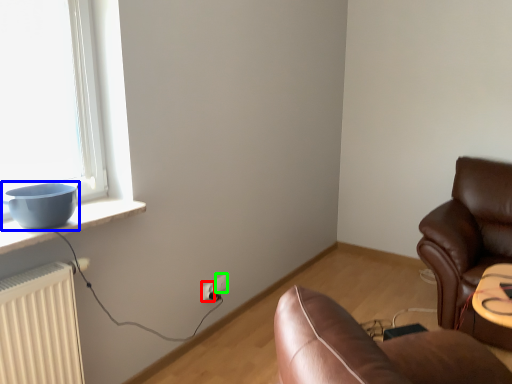
Question: Based on their relative distances, which object is nearer to electric outlet (highlighted by a red box)? Choose from bowl (highlighted by a blue box) and electric outlet (highlighted by a green box).

Choices:
 (A) bowl
 (B) electric outlet

Answer: (B)